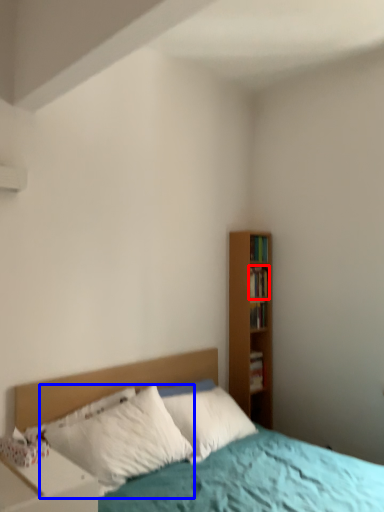
Question: Which point is further to the camera, book (highlighted by a red box) or pillow (highlighted by a blue box)?

Choices:
 (A) book
 (B) pillow

Answer: (A)